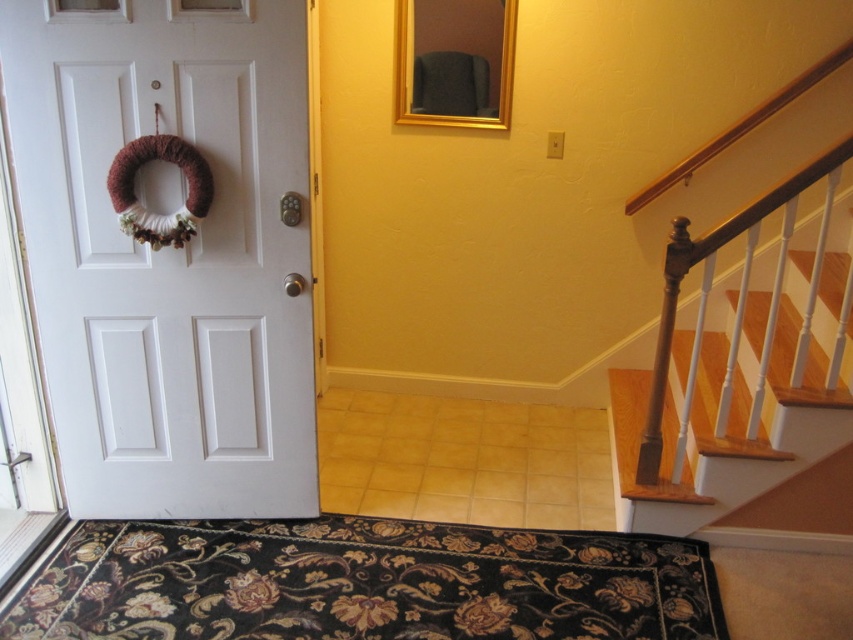
Question: Which of the following is the closest to the observer?

Choices:
 (A) (836, 394)
 (B) (221, 513)
 (C) (117, 625)

Answer: (C)

Question: Does white matte door at left appear on the right side of wooden stairs at right?

Choices:
 (A) no
 (B) yes

Answer: (A)

Question: Which point is closer to the camera?

Choices:
 (A) (165, 593)
 (B) (648, 518)

Answer: (A)

Question: Which of the following is the closest to the observer?

Choices:
 (A) (207, 596)
 (B) (689, 371)
 (C) (115, 58)

Answer: (C)

Question: Does white matte door at left appear on the right side of black floral rug at lower center?

Choices:
 (A) no
 (B) yes

Answer: (A)

Question: Is white matte door at left above wooden stairs at right?

Choices:
 (A) no
 (B) yes

Answer: (B)